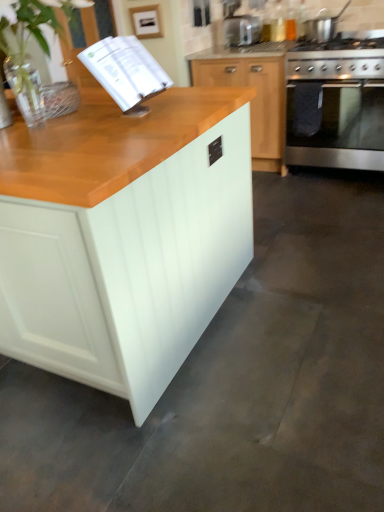
Question: Considering the relative positions of satin silver toaster at upper center and green leafy plant at upper left in the image provided, is satin silver toaster at upper center to the left of green leafy plant at upper left from the viewer's perspective?

Choices:
 (A) yes
 (B) no

Answer: (B)

Question: Can you confirm if satin silver toaster at upper center is bigger than green leafy plant at upper left?

Choices:
 (A) no
 (B) yes

Answer: (A)

Question: Can you confirm if satin silver toaster at upper center is smaller than green leafy plant at upper left?

Choices:
 (A) no
 (B) yes

Answer: (B)

Question: Does satin silver toaster at upper center appear on the right side of green leafy plant at upper left?

Choices:
 (A) yes
 (B) no

Answer: (A)

Question: Is satin silver toaster at upper center shorter than green leafy plant at upper left?

Choices:
 (A) no
 (B) yes

Answer: (B)

Question: From the image's perspective, is satin silver toaster at upper center beneath green leafy plant at upper left?

Choices:
 (A) yes
 (B) no

Answer: (B)

Question: Are white matte cabinet at center, the 1th cabinetry from the front, and satin silver toaster at upper center far apart?

Choices:
 (A) yes
 (B) no

Answer: (A)

Question: Does white matte cabinet at center, the 1th cabinetry from the front, lie in front of satin silver toaster at upper center?

Choices:
 (A) yes
 (B) no

Answer: (A)

Question: Is white matte cabinet at center, the 1th cabinetry from the front, taller than satin silver toaster at upper center?

Choices:
 (A) yes
 (B) no

Answer: (A)

Question: Is white matte cabinet at center, placed as the 2th cabinetry when sorted from right to left, facing away from satin silver toaster at upper center?

Choices:
 (A) yes
 (B) no

Answer: (B)

Question: From a real-world perspective, is white matte cabinet at center, placed as the 2th cabinetry when sorted from right to left, located beneath satin silver toaster at upper center?

Choices:
 (A) yes
 (B) no

Answer: (A)

Question: From the image's perspective, is white matte cabinet at center, arranged as the 2th cabinetry when viewed from the back, beneath satin silver toaster at upper center?

Choices:
 (A) no
 (B) yes

Answer: (B)

Question: Is white matte cabinet at center, the 1th cabinetry when ordered from left to right, outside white paper book at upper left?

Choices:
 (A) no
 (B) yes

Answer: (B)